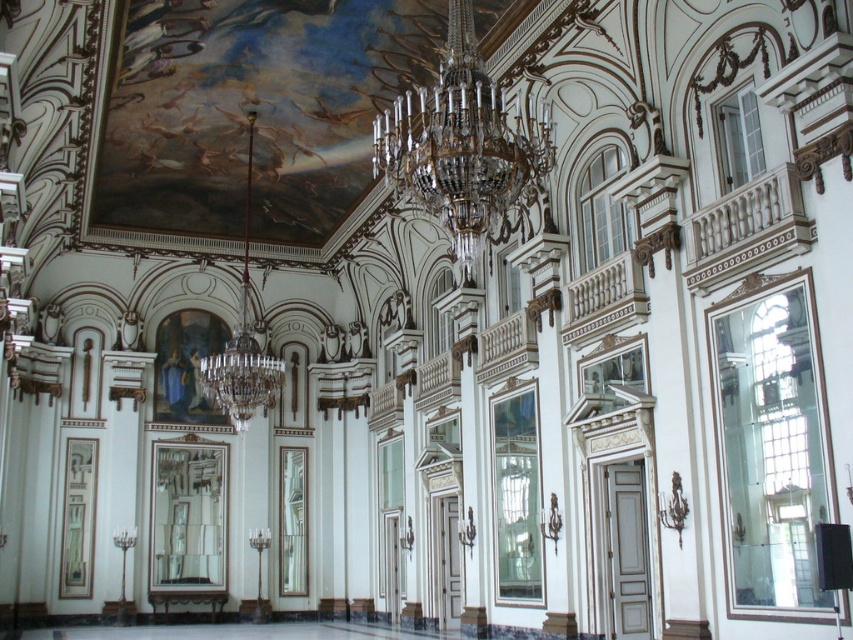
Between crystal/golden chandelier at center and crystal glass chandelier at center, which one appears on the left side from the viewer's perspective?

crystal glass chandelier at center

Is crystal/golden chandelier at center positioned before crystal glass chandelier at center?

Yes, crystal/golden chandelier at center is in front of crystal glass chandelier at center.

Locate an element on the screen. The image size is (853, 640). crystal/golden chandelier at center is located at coordinates (463, 147).